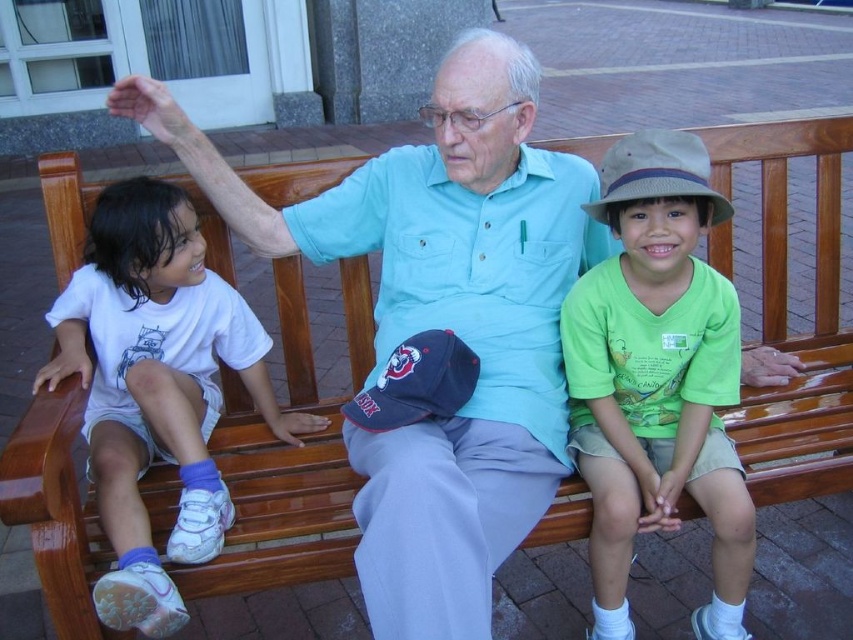
Who is lower down, green cotton shirt at center or white cotton shirt at left?

white cotton shirt at left

Between green cotton shirt at center and white cotton shirt at left, which one has less height?

With less height is white cotton shirt at left.

What do you see at coordinates (657, 378) in the screenshot?
I see `green cotton shirt at center` at bounding box center [657, 378].

Locate an element on the screen. This screenshot has width=853, height=640. green cotton shirt at center is located at coordinates 657,378.